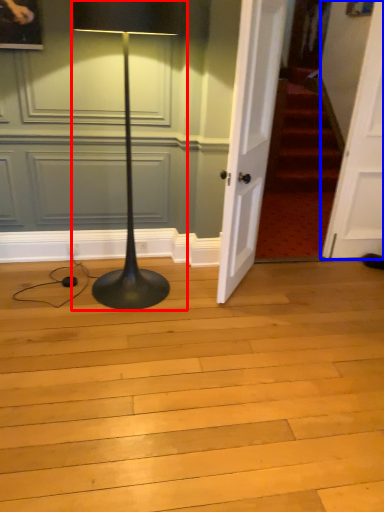
Question: Which object appears farthest to the camera in this image, lamp (highlighted by a red box) or door (highlighted by a blue box)?

Choices:
 (A) lamp
 (B) door

Answer: (B)